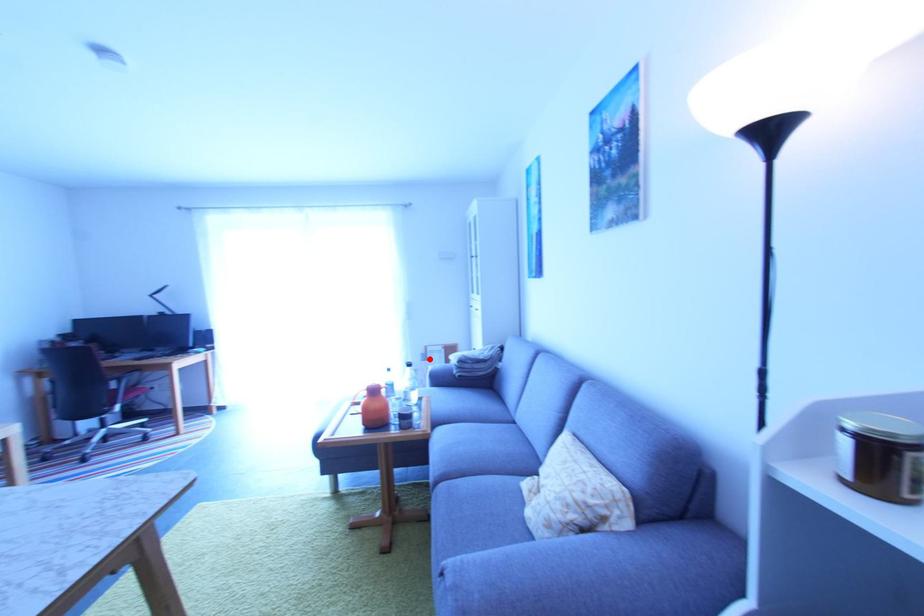
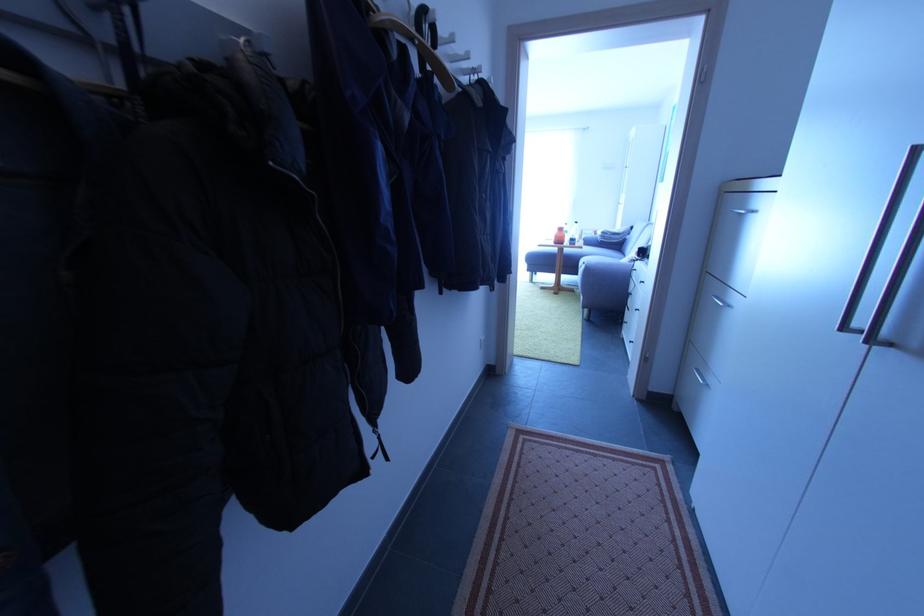
Where in the second image is the point corresponding to the highlighted location from the first image?

(585, 238)